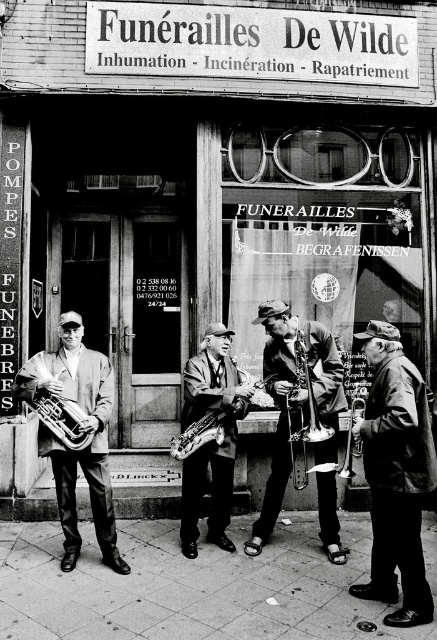
Question: Which point appears closest to the camera in this image?

Choices:
 (A) (72, 508)
 (B) (427, 449)
 (C) (191, 406)

Answer: (B)

Question: Considering the real-world distances, which object is closest to the matte black saxophone at left?

Choices:
 (A) brass tuba at left
 (B) brass shiny trumpet at center

Answer: (A)

Question: Can you confirm if brass tuba at left is positioned above brass trumpet at center?

Choices:
 (A) no
 (B) yes

Answer: (B)

Question: Does matte black saxophone at left have a greater width compared to brass trumpet at center?

Choices:
 (A) no
 (B) yes

Answer: (B)

Question: Considering the relative positions of brass tuba at left and brass shiny trumpet at center in the image provided, where is brass tuba at left located with respect to brass shiny trumpet at center?

Choices:
 (A) above
 (B) below

Answer: (A)

Question: Based on their relative distances, which object is nearer to the brass shiny trumpet at center?

Choices:
 (A) shiny brass trumpet at center
 (B) leather jacket at right
 (C) smooth leather jacket at center

Answer: (B)